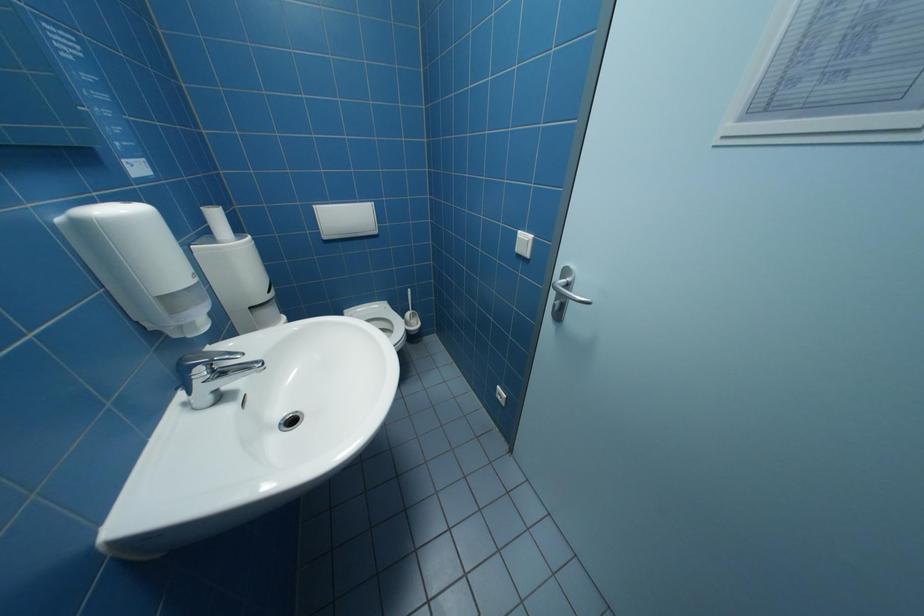
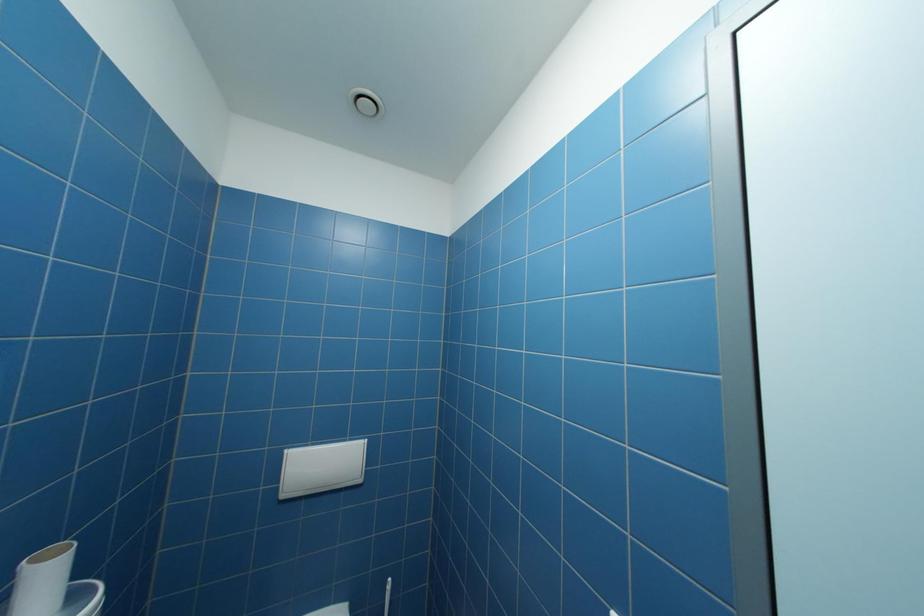
Question: How did the camera likely rotate?

Choices:
 (A) Left
 (B) Right
 (C) Up
 (D) Down

Answer: (C)